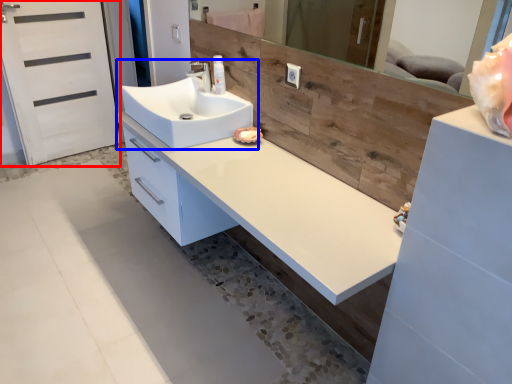
Question: Which object appears farthest to the camera in this image, screen door (highlighted by a red box) or sink (highlighted by a blue box)?

Choices:
 (A) screen door
 (B) sink

Answer: (A)